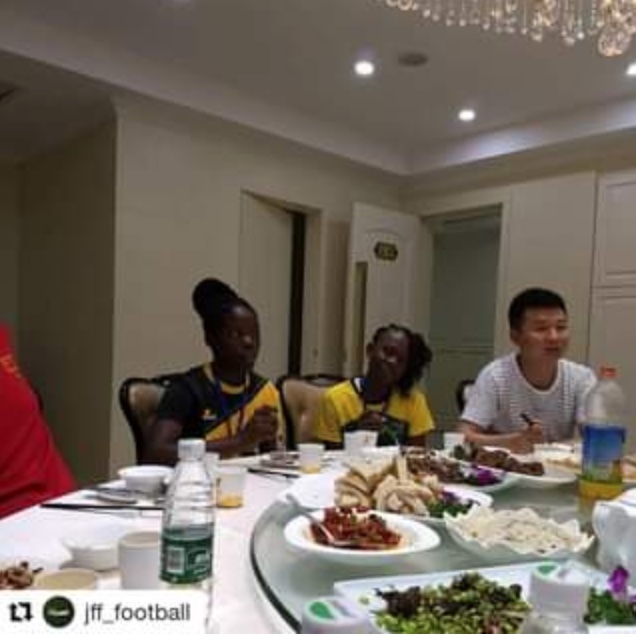
This screenshot has width=636, height=638. In order to click on utensil in this screenshot , I will do `click(527, 422)`.